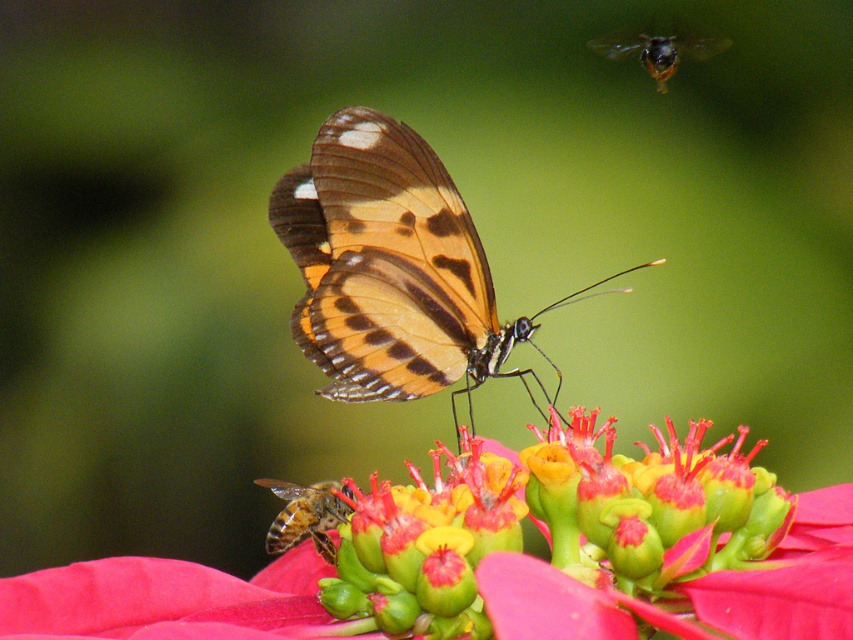
Question: Can you confirm if translucent yellow bee at lower left is wider than shiny metallic bee at upper right?

Choices:
 (A) no
 (B) yes

Answer: (A)

Question: Is smooth pink petals at center wider than shiny metallic bee at upper right?

Choices:
 (A) no
 (B) yes

Answer: (B)

Question: Is translucent yellow bee at lower left bigger than shiny metallic bee at upper right?

Choices:
 (A) no
 (B) yes

Answer: (A)

Question: Which object is closer to the camera taking this photo?

Choices:
 (A) smooth pink petals at center
 (B) translucent yellow bee at lower left
 (C) shiny metallic bee at upper right
 (D) orange-patterned butterfly at center

Answer: (A)

Question: Which of the following is the farthest from the observer?

Choices:
 (A) click(x=561, y=582)
 (B) click(x=401, y=337)
 (C) click(x=281, y=497)
 (D) click(x=669, y=44)

Answer: (D)

Question: Which object appears farthest from the camera in this image?

Choices:
 (A) smooth pink petals at center
 (B) shiny metallic bee at upper right
 (C) translucent yellow bee at lower left
 (D) orange-patterned butterfly at center

Answer: (B)